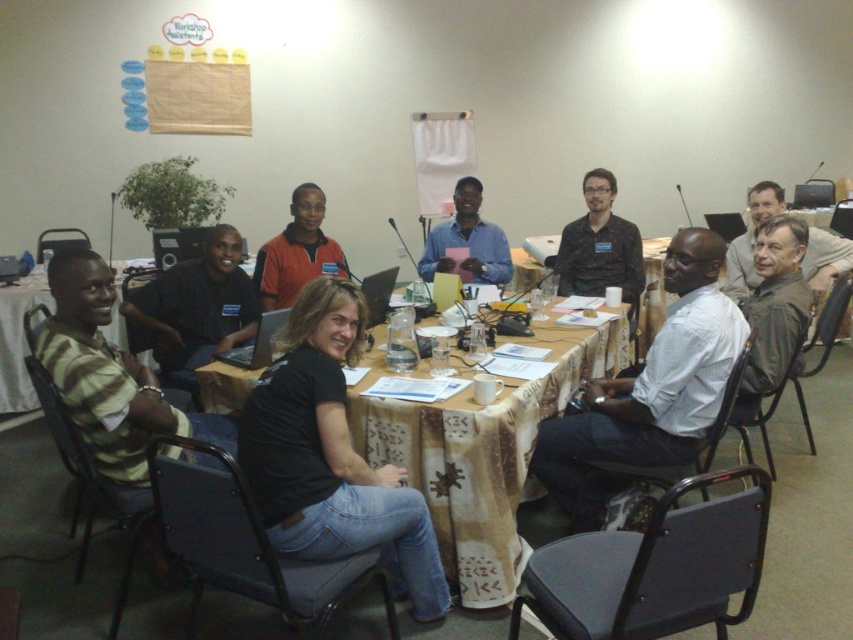
You are a photographer standing behind the long table in the workshop. You need to capture a photo of both the white shirt at center and the blue shirt at center. Which shirt should you focus on first if you want to ensure both are in the frame?

You should focus on the white shirt at center first because it is taller than the blue shirt at center, ensuring both are visible in the frame.

You are standing in the workshop and want to reach both the point at coordinates (724, 250) and the point at (238, 252). Which point should you move towards first to reach the closer one?

You should move towards point (724, 250) first because it is closer to you than point (238, 252).

You are standing at the entrance of the room and want to greet the person wearing the white shirt at center. Based on their position, in which direction should you walk to reach them?

The white shirt at center is located at point 0.608 on the x axis and 0.762 on the y axis. Since you are at the entrance, you should walk towards the center of the room to reach them.